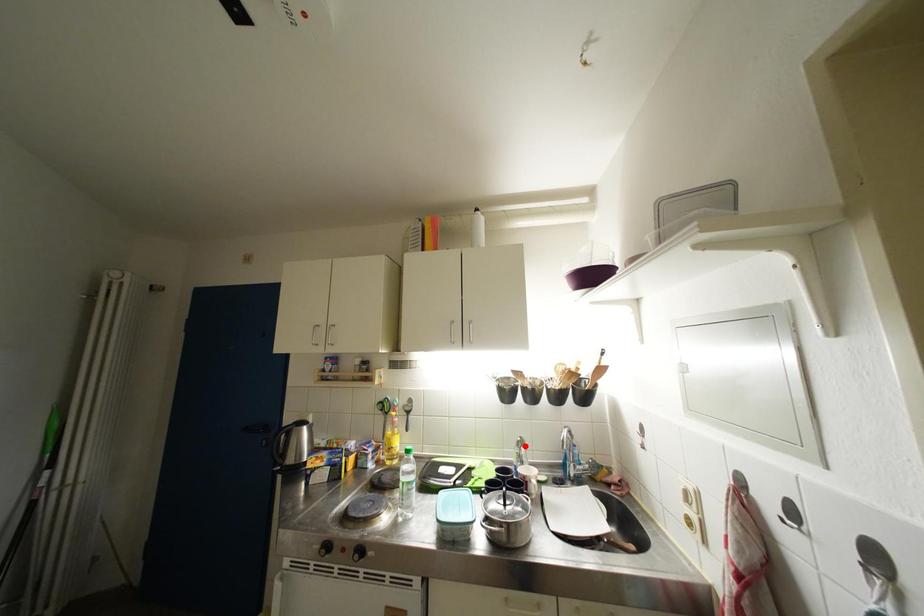
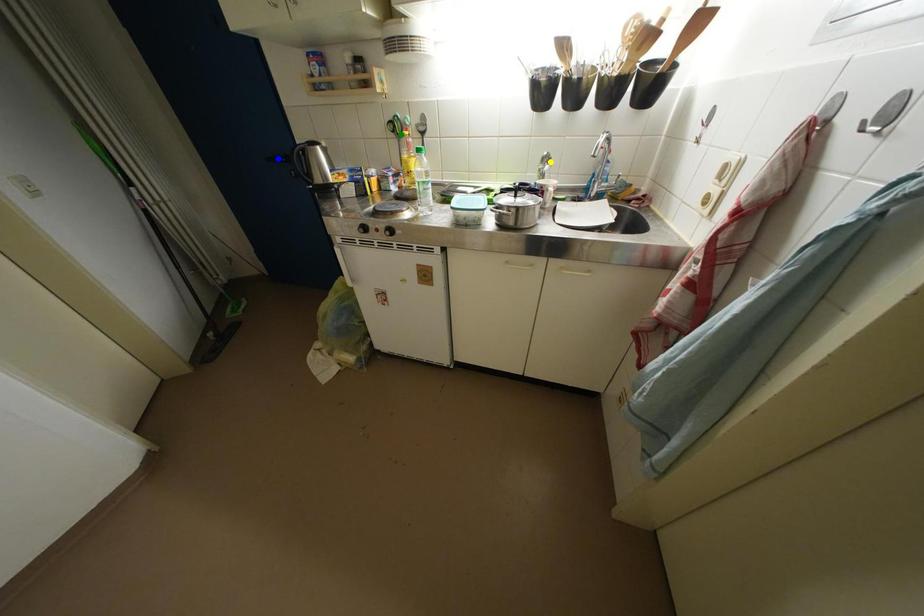
Question: I am providing you with two images of the same scene from different viewpoints. A red point is marked on the first image. You are given multiple points on the second image. Which point in image 2 is actually the same real-world point as the red point in image 1?

Choices:
 (A) yellow point
 (B) green point
 (C) blue point

Answer: (A)